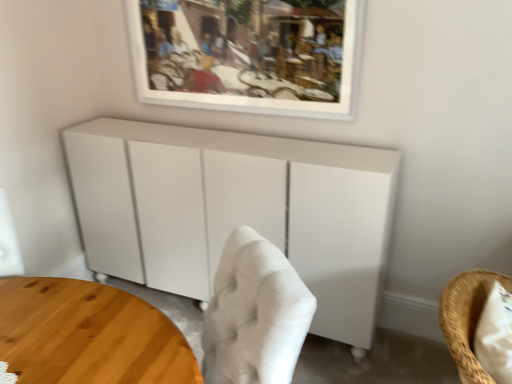
Image resolution: width=512 pixels, height=384 pixels. What are the coordinates of `white matte picture frame at upper center` in the screenshot? It's located at (247, 56).

What do you see at coordinates (234, 210) in the screenshot? The width and height of the screenshot is (512, 384). I see `white matte cabinet at center` at bounding box center [234, 210].

This screenshot has width=512, height=384. I want to click on woven straw chair at lower right, so click(x=467, y=318).

Looking at this image, from a real-world perspective, is white matte picture frame at upper center above or below woven straw chair at lower right?

white matte picture frame at upper center is above woven straw chair at lower right.

Can you tell me how much white matte picture frame at upper center and woven straw chair at lower right differ in facing direction?

They differ by 94.8 degrees in their facing directions.

Can you see white matte picture frame at upper center touching woven straw chair at lower right?

No, white matte picture frame at upper center is not next to woven straw chair at lower right.

Is white matte picture frame at upper center facing towards woven straw chair at lower right?

No, white matte picture frame at upper center does not turn towards woven straw chair at lower right.

Can you confirm if woven straw chair at lower right is positioned to the right of white matte cabinet at center?

Indeed, woven straw chair at lower right is positioned on the right side of white matte cabinet at center.

Is point (471, 312) less distant than point (347, 162)?

Yes.

Considering the relative positions of woven straw chair at lower right and white matte cabinet at center in the image provided, is woven straw chair at lower right in front of white matte cabinet at center?

Yes, woven straw chair at lower right is closer to the viewer.

Is woven straw chair at lower right turned away from white matte cabinet at center?

No, woven straw chair at lower right is not facing the opposite direction of white matte cabinet at center.

Is white matte cabinet at center outside of woven straw chair at lower right?

Yes, white matte cabinet at center is not within woven straw chair at lower right.

Does white matte cabinet at center have a lesser width compared to woven straw chair at lower right?

No, white matte cabinet at center is not thinner than woven straw chair at lower right.

How distant is white matte cabinet at center from woven straw chair at lower right?

The distance of white matte cabinet at center from woven straw chair at lower right is 39.11 inches.

From the image's perspective, is white matte cabinet at center on woven straw chair at lower right?

Yes, from the image's perspective, white matte cabinet at center is over woven straw chair at lower right.

Is point (95, 197) closer to viewer compared to point (131, 41)?

No, it is behind (131, 41).

Would you say white matte cabinet at center contains white matte picture frame at upper center?

No, white matte picture frame at upper center is not surrounded by white matte cabinet at center.

Can you confirm if white matte cabinet at center is wider than white matte picture frame at upper center?

Correct, the width of white matte cabinet at center exceeds that of white matte picture frame at upper center.

Is white matte cabinet at center at the left side of white matte picture frame at upper center?

Yes.

Does wooden round table at lower left come in front of white matte cabinet at center?

Yes, wooden round table at lower left is closer to the viewer.

Does wooden round table at lower left have a lesser height compared to white matte cabinet at center?

Correct, wooden round table at lower left is not as tall as white matte cabinet at center.

Can you confirm if wooden round table at lower left is thinner than white matte cabinet at center?

In fact, wooden round table at lower left might be wider than white matte cabinet at center.

Is white matte cabinet at center inside wooden round table at lower left?

Actually, white matte cabinet at center is outside wooden round table at lower left.

From the image's perspective, does white matte picture frame at upper center appear higher than wooden round table at lower left?

Correct, white matte picture frame at upper center appears higher than wooden round table at lower left in the image.

Is white matte picture frame at upper center oriented towards wooden round table at lower left?

No.

Between white matte picture frame at upper center and wooden round table at lower left, which one appears on the right side from the viewer's perspective?

From the viewer's perspective, white matte picture frame at upper center appears more on the right side.

Which is in front, point (270, 0) or point (66, 282)?

The point (66, 282) is more forward.

You are a GUI agent. You are given a task and a screenshot of the screen. Output one action in this format:
    pyautogui.click(x=<x>, y=<y>)
    Task: Click on the picture frame that is above the woven straw chair at lower right (from a real-world perspective)
    
    Given the screenshot: What is the action you would take?
    pyautogui.click(x=247, y=56)

From the image's perspective, is woven straw chair at lower right above white matte picture frame at upper center?

No, from the image's perspective, woven straw chair at lower right is not above white matte picture frame at upper center.

Is woven straw chair at lower right facing towards white matte picture frame at upper center?

No, woven straw chair at lower right is not aimed at white matte picture frame at upper center.

Is woven straw chair at lower right beside white matte picture frame at upper center?

There is a gap between woven straw chair at lower right and white matte picture frame at upper center.

Locate an element on the screen. This screenshot has height=384, width=512. picture frame that appears behind the woven straw chair at lower right is located at coordinates (247, 56).

The image size is (512, 384). In order to click on cabinetry below the woven straw chair at lower right (from a real-world perspective) in this screenshot , I will do `click(234, 210)`.

Based on their spatial positions, is woven straw chair at lower right or white matte picture frame at upper center further from wooden round table at lower left?

white matte picture frame at upper center lies further to wooden round table at lower left than the other object.

Looking at the image, which one is located further to white matte cabinet at center, wooden round table at lower left or woven straw chair at lower right?

woven straw chair at lower right.

Looking at the image, which one is located closer to woven straw chair at lower right, white matte picture frame at upper center or wooden round table at lower left?

Among the two, wooden round table at lower left is located nearer to woven straw chair at lower right.

Looking at the image, which one is located further to white matte cabinet at center, white matte picture frame at upper center or wooden round table at lower left?

wooden round table at lower left.

Based on their spatial positions, is wooden round table at lower left or white matte cabinet at center closer to woven straw chair at lower right?

wooden round table at lower left lies closer to woven straw chair at lower right than the other object.

Estimate the real-world distances between objects in this image. Which object is further from wooden round table at lower left, white matte picture frame at upper center or white matte cabinet at center?

white matte picture frame at upper center is positioned further to the anchor wooden round table at lower left.

Looking at the image, which one is located closer to wooden round table at lower left, white matte cabinet at center or white matte picture frame at upper center?

white matte cabinet at center is positioned closer to the anchor wooden round table at lower left.

When comparing their distances from woven straw chair at lower right, does white matte picture frame at upper center or white matte cabinet at center seem closer?

Among the two, white matte cabinet at center is located nearer to woven straw chair at lower right.

The image size is (512, 384). I want to click on chair between white matte picture frame at upper center and wooden round table at lower left vertically, so click(x=467, y=318).

Locate an element on the screen. The width and height of the screenshot is (512, 384). cabinetry that lies between white matte picture frame at upper center and wooden round table at lower left from top to bottom is located at coordinates pos(234,210).

In order to click on cabinetry that lies between white matte picture frame at upper center and woven straw chair at lower right from top to bottom in this screenshot , I will do `click(234, 210)`.

At what (x,y) coordinates should I click in order to perform the action: click on cabinetry situated between wooden round table at lower left and woven straw chair at lower right from left to right. Please return your answer as a coordinate pair (x, y). Looking at the image, I should click on (234, 210).